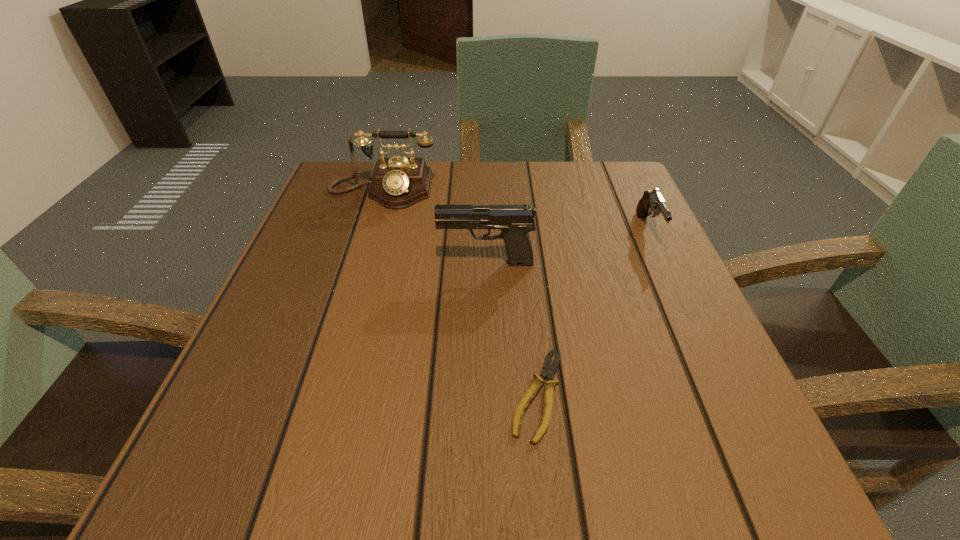
I want to click on object positioned at the far right corner, so click(x=652, y=201).

The width and height of the screenshot is (960, 540). In the image, there is a desktop. In order to click on free space at the far edge in this screenshot , I will do `click(430, 215)`.

You are a GUI agent. You are given a task and a screenshot of the screen. Output one action in this format:
    pyautogui.click(x=<x>, y=<y>)
    Task: Click on the blank area at the near edge
    This screenshot has height=540, width=960.
    Given the screenshot: What is the action you would take?
    pyautogui.click(x=460, y=439)

In the image, there is a desktop. Identify the location of vacant space at the left edge. (352, 244).

Where is `free space at the right edge of the desktop`? Image resolution: width=960 pixels, height=540 pixels. free space at the right edge of the desktop is located at coordinates (680, 343).

The image size is (960, 540). In order to click on vacant space at the near left corner in this screenshot , I will do `click(270, 474)`.

I want to click on free space at the far right corner, so click(623, 167).

The width and height of the screenshot is (960, 540). I want to click on vacant space that is in between the leftmost object and the pliers, so click(x=460, y=292).

Locate an element on the screen. The image size is (960, 540). empty space between the shortest object and the third farthest object is located at coordinates (512, 328).

I want to click on vacant point located between the leftmost object and the taller pistol, so click(x=434, y=227).